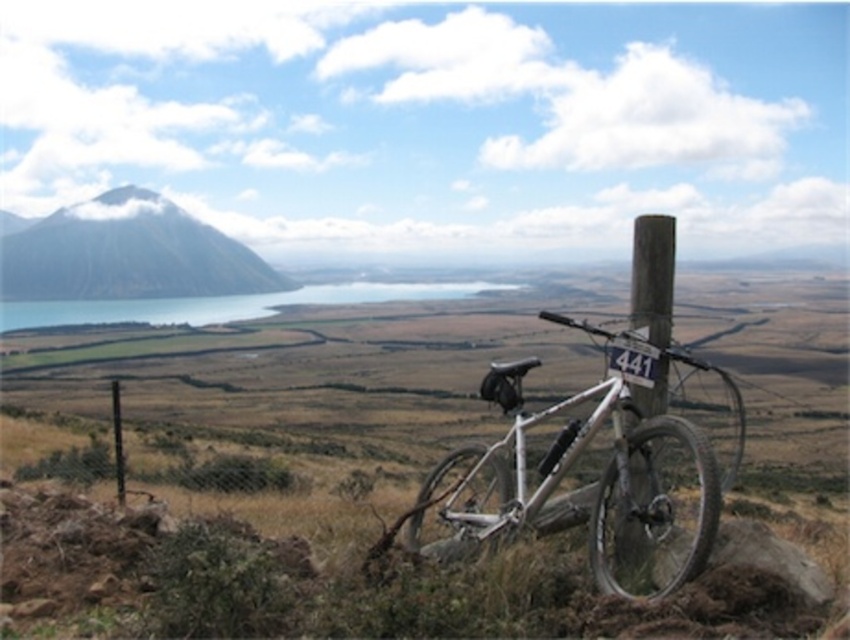
Question: From the image, what is the correct spatial relationship of green grassy hillside at left in relation to blue glassy lake at center?

Choices:
 (A) right
 (B) left

Answer: (B)

Question: Where is silver metallic mountain bike at center located in relation to green grassy hillside at left in the image?

Choices:
 (A) below
 (B) above

Answer: (A)

Question: Among these points, which one is nearest to the camera?

Choices:
 (A) (41, 323)
 (B) (700, 454)

Answer: (B)

Question: Among these points, which one is nearest to the camera?

Choices:
 (A) (646, 300)
 (B) (343, 284)
 (C) (102, 232)

Answer: (A)

Question: Can you confirm if green grassy hillside at left is thinner than wooden post at right?

Choices:
 (A) yes
 (B) no

Answer: (B)

Question: Based on their relative distances, which object is farther from the wooden post at right?

Choices:
 (A) blue glassy lake at center
 (B) green grassy hillside at left
 (C) silver metallic mountain bike at center

Answer: (B)